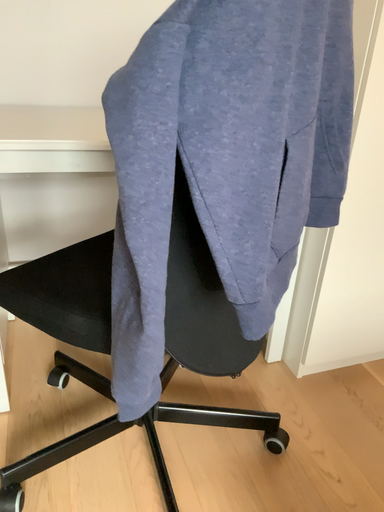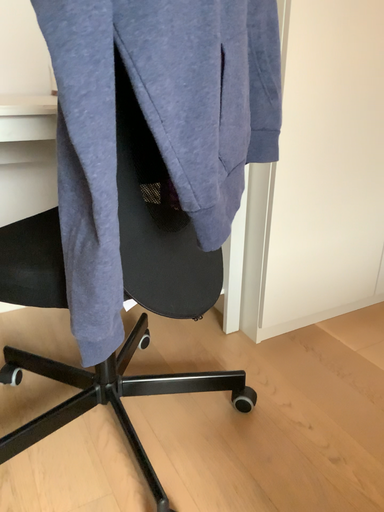
Question: How did the camera likely rotate when shooting the video?

Choices:
 (A) rotated left
 (B) rotated right

Answer: (B)